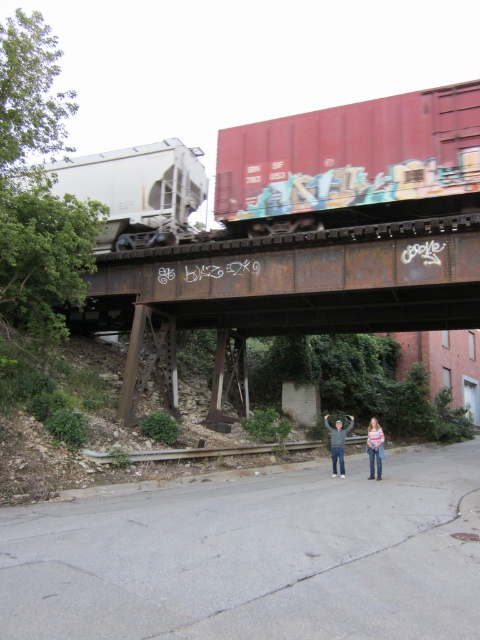
Who is higher up, gray fleece jacket at center or striped sweater at center?

Positioned higher is gray fleece jacket at center.

Which is in front, point (331, 432) or point (372, 429)?

Positioned in front is point (372, 429).

Locate an element on the screen. gray fleece jacket at center is located at coordinates (337, 444).

Can you confirm if red matte freight car at upper center is smaller than striped sweater at center?

Yes.

Can you confirm if red matte freight car at upper center is positioned above striped sweater at center?

Indeed, red matte freight car at upper center is positioned over striped sweater at center.

This screenshot has width=480, height=640. Identify the location of red matte freight car at upper center. (349, 161).

At what (x,y) coordinates should I click in order to perform the action: click on red matte freight car at upper center. Please return your answer as a coordinate pair (x, y). This screenshot has width=480, height=640. Looking at the image, I should click on (349, 161).

Can you confirm if red matte freight car at upper center is wider than denim jeans at center?

Correct, the width of red matte freight car at upper center exceeds that of denim jeans at center.

Is red matte freight car at upper center to the right of denim jeans at center from the viewer's perspective?

In fact, red matte freight car at upper center is to the left of denim jeans at center.

Image resolution: width=480 pixels, height=640 pixels. What do you see at coordinates (349, 161) in the screenshot? I see `red matte freight car at upper center` at bounding box center [349, 161].

Locate an element on the screen. This screenshot has height=640, width=480. red matte freight car at upper center is located at coordinates (349, 161).